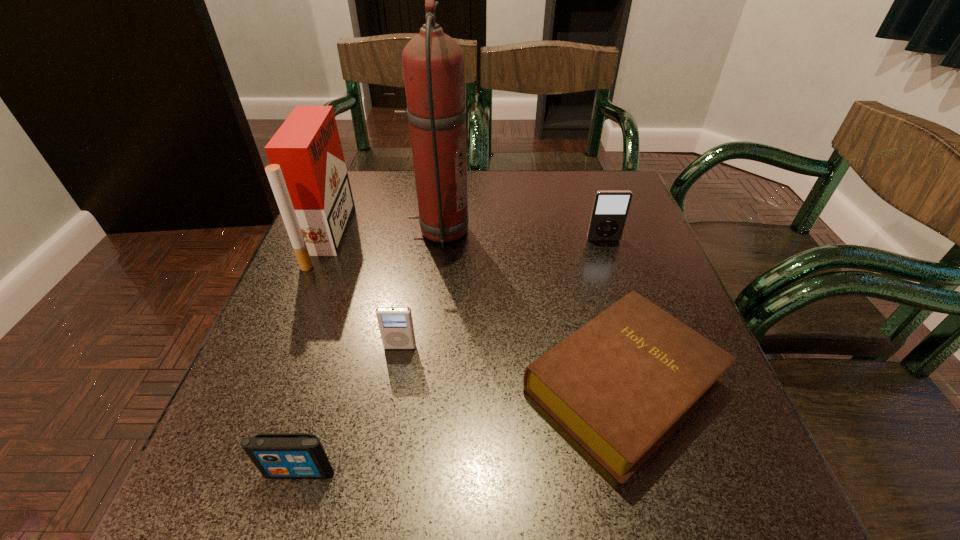
Where is `vacant space located 0.310m on the front-facing side of the cigarette case`? This screenshot has width=960, height=540. vacant space located 0.310m on the front-facing side of the cigarette case is located at coordinates (475, 236).

Locate an element on the screen. This screenshot has width=960, height=540. free location located 0.050m on the front-facing side of the tallest iPod is located at coordinates (609, 255).

The width and height of the screenshot is (960, 540). Identify the location of vacant space situated 0.200m on the front-facing side of the second iPod from right to left. (382, 458).

The image size is (960, 540). Identify the location of vacant space located on the left of the shortest object. (404, 384).

The width and height of the screenshot is (960, 540). Find the location of `fire extinguisher that is at the far edge`. fire extinguisher that is at the far edge is located at coordinates [x=433, y=62].

Locate an element on the screen. cigarette case located at the far edge is located at coordinates (307, 173).

Find the location of a particular element. iPod located at the near edge is located at coordinates (276, 455).

The height and width of the screenshot is (540, 960). Identify the location of Bible located at the near edge. (622, 384).

Identify the location of cigarette case that is at the left edge. (307, 173).

Identify the location of iPod that is at the left edge. (276, 455).